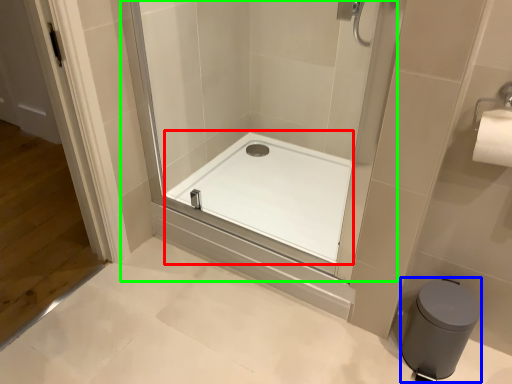
Question: Which is farther away from bath (highlighted by a red box)? bidet (highlighted by a blue box) or shower door (highlighted by a green box)?

Choices:
 (A) bidet
 (B) shower door

Answer: (A)